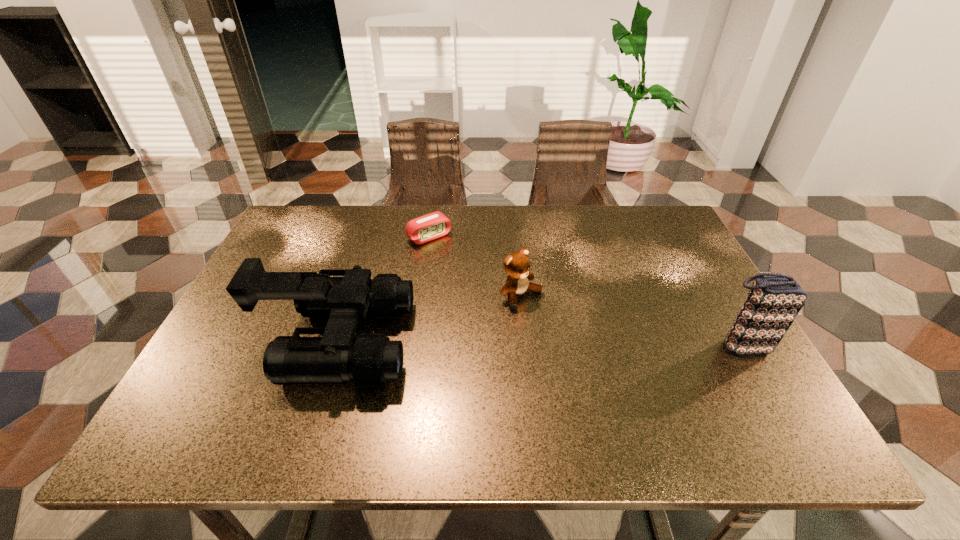
You are a GUI agent. You are given a task and a screenshot of the screen. Output one action in this format:
    pyautogui.click(x=<x>, y=<y>)
    Task: Click on the vacant area at the left edge
    This screenshot has height=540, width=960.
    Given the screenshot: What is the action you would take?
    pyautogui.click(x=257, y=338)

The width and height of the screenshot is (960, 540). In order to click on free point at the right edge in this screenshot , I will do `click(727, 330)`.

Where is `free location at the far left corner of the desktop`? free location at the far left corner of the desktop is located at coordinates (304, 213).

Find the location of a particular element. vacant space at the near left corner of the desktop is located at coordinates (249, 384).

Where is `free location at the far right corner of the desktop`? The height and width of the screenshot is (540, 960). free location at the far right corner of the desktop is located at coordinates (674, 242).

Locate an element on the screen. The width and height of the screenshot is (960, 540). free point between the third tallest object and the binoculars is located at coordinates (429, 319).

Identify the location of free point between the binoculars and the rightmost object. (540, 343).

The image size is (960, 540). Identify the location of free spot between the alarm clock and the rightmost object. (586, 292).

You are a GUI agent. You are given a task and a screenshot of the screen. Output one action in this format:
    pyautogui.click(x=<x>, y=<y>)
    Task: Click on the free spot between the third tallest object and the binoculars
    This screenshot has width=960, height=540.
    Given the screenshot: What is the action you would take?
    pyautogui.click(x=429, y=319)

What are the coordinates of `free space between the binoculars and the teddy bear` in the screenshot? It's located at (429, 319).